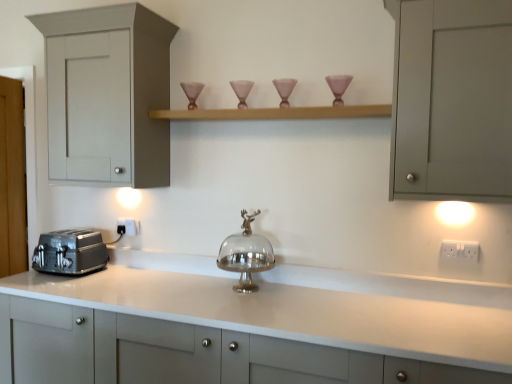
Question: From the image's perspective, is matte gray cabinet at left, which is the third cabinetry from bottom to top, located above or below white plastic electric outlet at right, which is the 1th electric outlet in front-to-back order?

Choices:
 (A) above
 (B) below

Answer: (A)

Question: Considering the positions of matte gray cabinet at left, which is the third cabinetry from bottom to top, and white plastic electric outlet at right, the 2th electric outlet when ordered from back to front, in the image, is matte gray cabinet at left, which is the third cabinetry from bottom to top, taller or shorter than white plastic electric outlet at right, the 2th electric outlet when ordered from back to front,?

Choices:
 (A) tall
 (B) short

Answer: (A)

Question: Which of these objects is positioned farthest from the wooden shelf at upper center?

Choices:
 (A) white plastic electric outlet at right, which is the 1th electric outlet in front-to-back order
 (B) matte gray cabinet at left, which is the third cabinetry from bottom to top
 (C) matte gray cabinet at upper right, which is counted as the second cabinetry, starting from the top
 (D) matte pink glass candle holder at upper right
 (E) satin silver toaster at lower left

Answer: (A)

Question: Based on their relative distances, which object is nearer to the white glossy countertop at center, the 1th cabinetry from the bottom?

Choices:
 (A) satin silver toaster at lower left
 (B) white plastic electric outlet at lower center, positioned as the second electric outlet in right-to-left order
 (C) matte gray cabinet at left, which is the third cabinetry from bottom to top
 (D) matte pink glass candle holder at upper right
 (E) wooden shelf at upper center

Answer: (A)